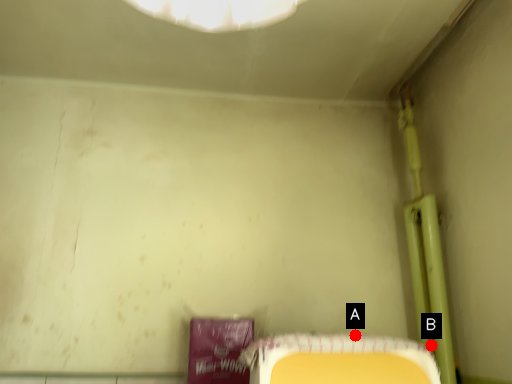
Question: Two points are circled on the image, labeled by A and B beside each circle. Which point is closer to the camera?

Choices:
 (A) A is closer
 (B) B is closer

Answer: (B)